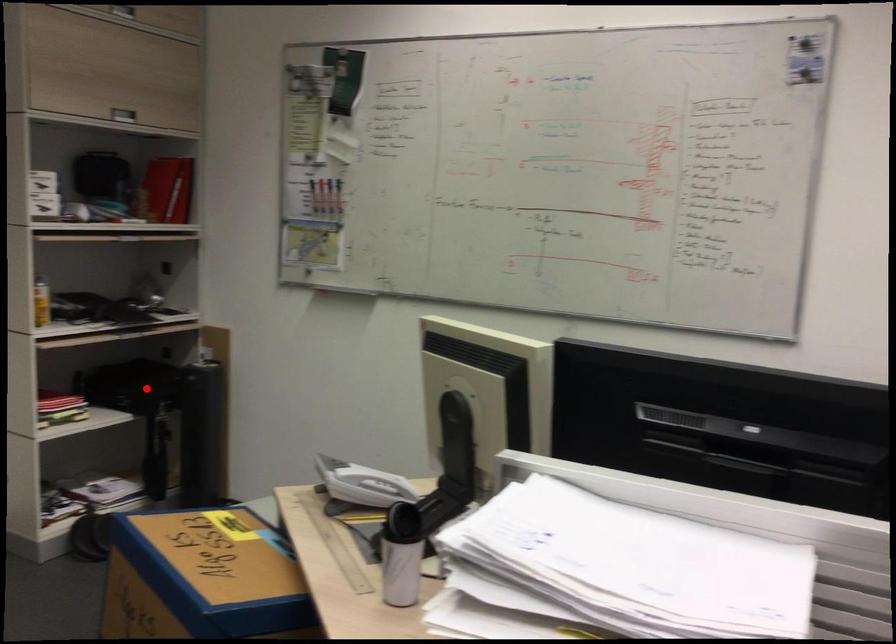
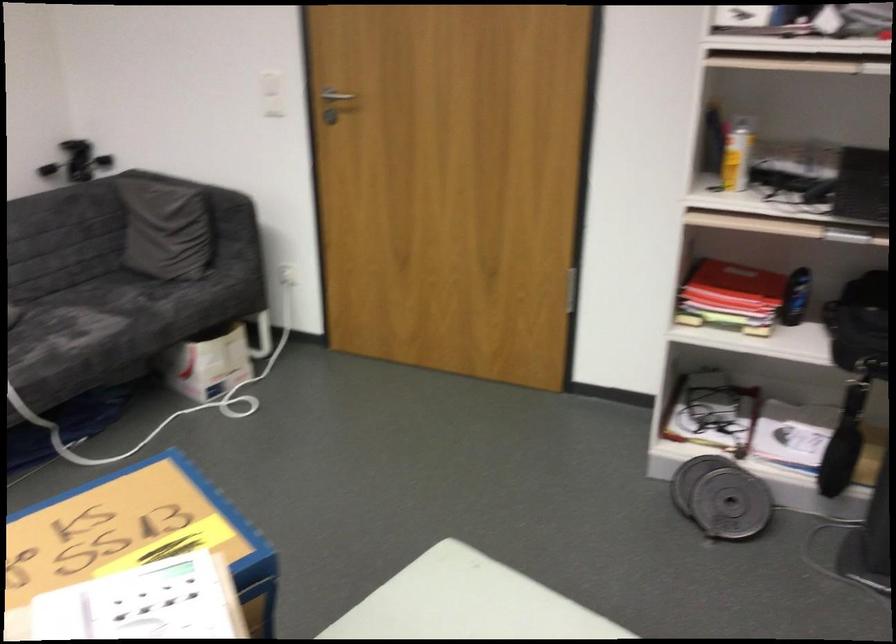
Question: A red point is marked in image1. In image2, is the corresponding 3D point closer to the camera or farther? Reply with the corresponding letter.

Choices:
 (A) The corresponding 3D point is closer.
 (B) The corresponding 3D point is farther.

Answer: (A)